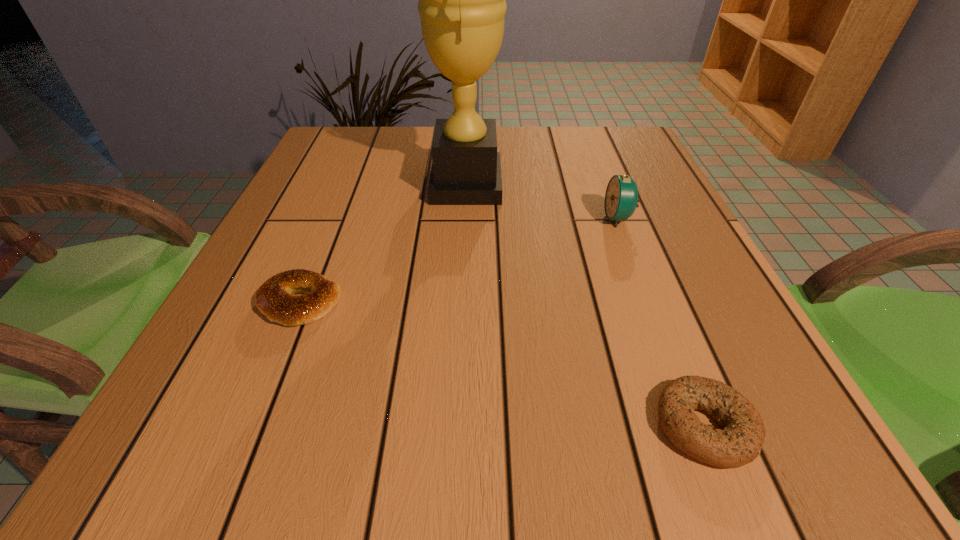
Where is `vacant point located on the front-facing side of the third shortest object`? vacant point located on the front-facing side of the third shortest object is located at coordinates (571, 218).

Find the location of a particular element. The width and height of the screenshot is (960, 540). vacant space located 0.330m on the back of the nearer bagel is located at coordinates (630, 240).

This screenshot has height=540, width=960. In order to click on free space located on the front of the second nearest object in this screenshot , I will do `click(259, 403)`.

Where is `object present at the far edge`? This screenshot has height=540, width=960. object present at the far edge is located at coordinates (462, 6).

What are the coordinates of `object that is at the near edge` in the screenshot? It's located at click(x=740, y=441).

Image resolution: width=960 pixels, height=540 pixels. In order to click on object present at the left edge in this screenshot , I will do (274, 298).

The image size is (960, 540). Identify the location of alarm clock that is at the right edge. (621, 198).

The image size is (960, 540). What are the coordinates of `bagel present at the right edge` in the screenshot? It's located at (740, 441).

Where is `object situated at the near right corner`? object situated at the near right corner is located at coordinates (740, 441).

Identify the location of blank space at the far edge of the desktop. Image resolution: width=960 pixels, height=540 pixels. (563, 129).